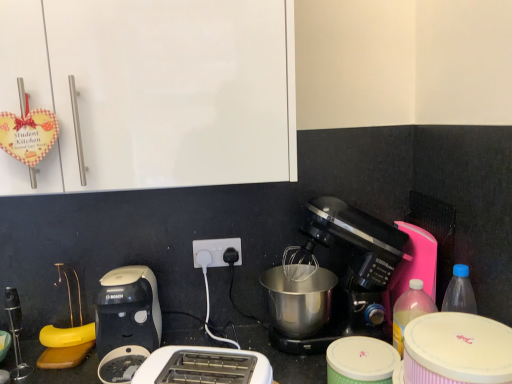
Question: Considering the positions of point (92, 62) and point (310, 342), is point (92, 62) closer or farther from the camera than point (310, 342)?

Choices:
 (A) farther
 (B) closer

Answer: (B)

Question: Is white glossy cabinet at upper left inside the boundaries of black plastic coffee maker at center, or outside?

Choices:
 (A) inside
 (B) outside

Answer: (B)

Question: Which object is positioned closest to the white plastic toaster at lower center, the 2th toaster positioned from the left?

Choices:
 (A) pink plastic bottle at right
 (B) pink striped container at lower right, acting as the second appliance starting from the bottom
 (C) white glossy cabinet at upper left
 (D) white plastic power plugs and sockets at center
 (E) green polka dot container at lower center, placed as the 1th appliance when sorted from bottom to top

Answer: (E)

Question: Which object is positioned farthest from the white glossy cabinet at upper left?

Choices:
 (A) white plastic toaster at lower left, the first toaster positioned from the back
 (B) pink plastic bottle at right
 (C) white plastic power plugs and sockets at center
 (D) pink striped container at lower right, acting as the second appliance starting from the bottom
 (E) green polka dot container at lower center, placed as the 1th appliance when sorted from bottom to top

Answer: (B)